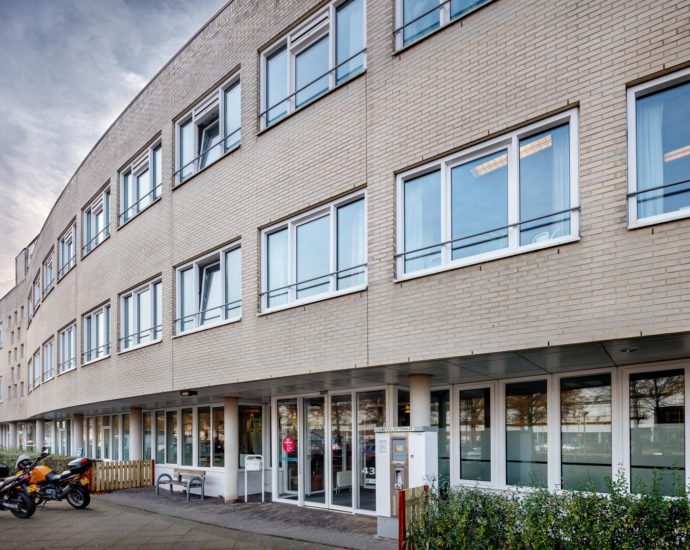
Find the location of a particular element. support posts is located at coordinates (10, 439), (39, 443), (75, 447), (132, 447), (232, 451), (426, 411).